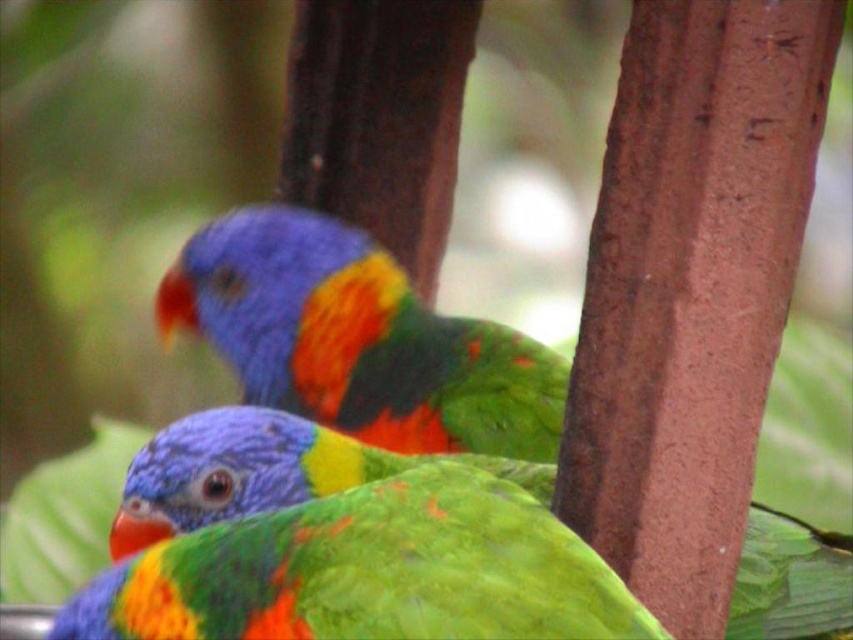
Question: Among these objects, which one is farthest from the camera?

Choices:
 (A) shiny multicolored parrot at center
 (B) shiny green parrot at center

Answer: (A)

Question: Which object is farther from the camera taking this photo?

Choices:
 (A) shiny multicolored parrot at center
 (B) shiny green parrot at center

Answer: (A)

Question: Is shiny multicolored parrot at center bigger than shiny green parrot at center?

Choices:
 (A) no
 (B) yes

Answer: (B)

Question: Does shiny multicolored parrot at center come in front of shiny green parrot at center?

Choices:
 (A) no
 (B) yes

Answer: (A)

Question: Which of the following is the closest to the observer?

Choices:
 (A) shiny green parrot at center
 (B) shiny multicolored parrot at center

Answer: (A)

Question: Observing the image, what is the correct spatial positioning of shiny multicolored parrot at center in reference to shiny green parrot at center?

Choices:
 (A) right
 (B) left

Answer: (B)